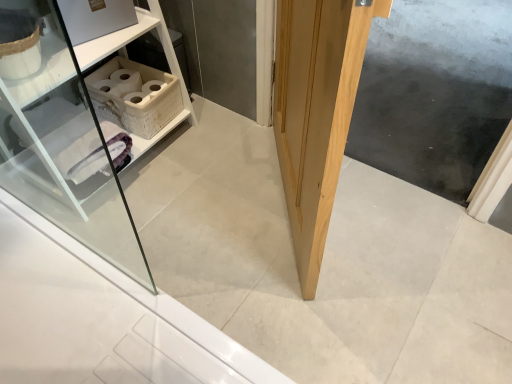
From the picture: What is the approximate width of natural wood screen door at center?

It is 6.35 feet.

Describe the element at coordinates (136, 95) in the screenshot. I see `white wicker basket at upper left` at that location.

The width and height of the screenshot is (512, 384). I want to click on natural wood door at center, so click(x=316, y=112).

Do you think white wicker basket at upper left is within natural wood door at center, or outside of it?

white wicker basket at upper left is not enclosed by natural wood door at center.

Consider the image. Considering the relative sizes of white wicker basket at upper left and natural wood door at center in the image provided, is white wicker basket at upper left wider than natural wood door at center?

Indeed, white wicker basket at upper left has a greater width compared to natural wood door at center.

Is white wicker basket at upper left oriented away from natural wood door at center?

No.

Based on the photo, from a real-world perspective, is white wicker basket at upper left above or below natural wood door at center?

white wicker basket at upper left is situated lower than natural wood door at center in the real world.

Is white wicker shelf at upper left in contact with white wicker basket at upper left?

white wicker shelf at upper left is not next to white wicker basket at upper left, and they're not touching.

Considering the relative sizes of white wicker shelf at upper left and white wicker basket at upper left in the image provided, is white wicker shelf at upper left shorter than white wicker basket at upper left?

No, white wicker shelf at upper left is not shorter than white wicker basket at upper left.

Considering the sizes of objects white wicker shelf at upper left and white wicker basket at upper left in the image provided, who is thinner, white wicker shelf at upper left or white wicker basket at upper left?

With smaller width is white wicker basket at upper left.

Which of these two, white wicker shelf at upper left or white wicker basket at upper left, is bigger?

white wicker shelf at upper left.

Does natural wood screen door at center appear on the right side of white wicker shelf at upper left?

Correct, you'll find natural wood screen door at center to the right of white wicker shelf at upper left.

Which of these two, natural wood screen door at center or white wicker shelf at upper left, is wider?

Wider between the two is natural wood screen door at center.

Which is closer, (x=408, y=72) or (x=97, y=53)?

The point (x=97, y=53) is closer to the camera.

Is natural wood screen door at center facing towards white wicker shelf at upper left?

No, natural wood screen door at center is not oriented towards white wicker shelf at upper left.

From the image's perspective, relative to natural wood screen door at center, is white wicker basket at upper left above or below?

white wicker basket at upper left is situated lower than natural wood screen door at center in the image.

Find the location of a particular element. Image resolution: width=512 pixels, height=384 pixels. cabinetry located in front of the natural wood screen door at center is located at coordinates (136, 95).

Consider the image. Is white wicker basket at upper left closer to camera compared to natural wood screen door at center?

Yes, white wicker basket at upper left is closer to the viewer.

From a real-world perspective, does white wicker basket at upper left stand above natural wood screen door at center?

Yes.

Can you tell me how much white wicker shelf at upper left and natural wood door at center differ in facing direction?

They differ by 40.3 degrees in their facing directions.

Does white wicker shelf at upper left have a greater height compared to natural wood door at center?

No, white wicker shelf at upper left is not taller than natural wood door at center.

Is white wicker shelf at upper left placed right next to natural wood door at center?

white wicker shelf at upper left is not next to natural wood door at center, and they're not touching.

This screenshot has height=384, width=512. In order to click on shelf that is on the left side of natural wood door at center in this screenshot , I will do `click(124, 46)`.

Find the location of a particular element. This screenshot has width=512, height=384. cabinetry below the natural wood screen door at center (from the image's perspective) is located at coordinates (136, 95).

Choose the correct answer: Is natural wood screen door at center inside white wicker basket at upper left or outside it?

natural wood screen door at center is not enclosed by white wicker basket at upper left.

In the scene shown: Can you confirm if natural wood screen door at center is positioned to the left of white wicker basket at upper left?

In fact, natural wood screen door at center is to the right of white wicker basket at upper left.

Is the depth of natural wood screen door at center less than that of white wicker basket at upper left?

No, natural wood screen door at center is further to the viewer.

Is natural wood door at center looking in the opposite direction of white wicker basket at upper left?

Yes, natural wood door at center's orientation is away from white wicker basket at upper left.

From the image's perspective, is natural wood door at center located beneath white wicker basket at upper left?

Indeed, from the image's perspective, natural wood door at center is shown beneath white wicker basket at upper left.

Which point is more forward, (327,185) or (105,78)?

The point (327,185) is closer to the camera.

Locate an element on the screen. This screenshot has height=384, width=512. door in front of the white wicker basket at upper left is located at coordinates (316, 112).

Where is `cabinetry below the white wicker shelf at upper left (from the image's perspective)`? cabinetry below the white wicker shelf at upper left (from the image's perspective) is located at coordinates (136, 95).

Based on the photo, from the image, which object appears to be farther from white wicker shelf at upper left, white wicker basket at upper left or natural wood screen door at center?

natural wood screen door at center lies further to white wicker shelf at upper left than the other object.

When comparing their distances from white wicker shelf at upper left, does natural wood screen door at center or white wicker basket at upper left seem closer?

white wicker basket at upper left is closer to white wicker shelf at upper left.

Considering their positions, is natural wood screen door at center positioned further to white wicker basket at upper left than natural wood door at center?

The object further to white wicker basket at upper left is natural wood screen door at center.

Looking at the image, which one is located closer to white wicker basket at upper left, white wicker shelf at upper left or natural wood door at center?

white wicker shelf at upper left.

Based on their spatial positions, is natural wood screen door at center or white wicker shelf at upper left closer to natural wood door at center?

white wicker shelf at upper left lies closer to natural wood door at center than the other object.

When comparing their distances from natural wood door at center, does white wicker basket at upper left or natural wood screen door at center seem closer?

white wicker basket at upper left lies closer to natural wood door at center than the other object.

From the image, which object appears to be nearer to natural wood screen door at center, natural wood door at center or white wicker basket at upper left?

Based on the image, natural wood door at center appears to be nearer to natural wood screen door at center.

Estimate the real-world distances between objects in this image. Which object is closer to natural wood door at center, white wicker shelf at upper left or natural wood screen door at center?

white wicker shelf at upper left lies closer to natural wood door at center than the other object.

This screenshot has width=512, height=384. What are the coordinates of `door located between white wicker basket at upper left and natural wood screen door at center in the left-right direction` in the screenshot? It's located at (316, 112).

Where is `cabinetry located between white wicker shelf at upper left and natural wood screen door at center in the left-right direction`? The width and height of the screenshot is (512, 384). cabinetry located between white wicker shelf at upper left and natural wood screen door at center in the left-right direction is located at coordinates (136, 95).

This screenshot has height=384, width=512. Identify the location of door situated between white wicker shelf at upper left and natural wood screen door at center from left to right. (316, 112).

The width and height of the screenshot is (512, 384). I want to click on shelf between natural wood door at center and white wicker basket at upper left in the front-back direction, so click(x=124, y=46).